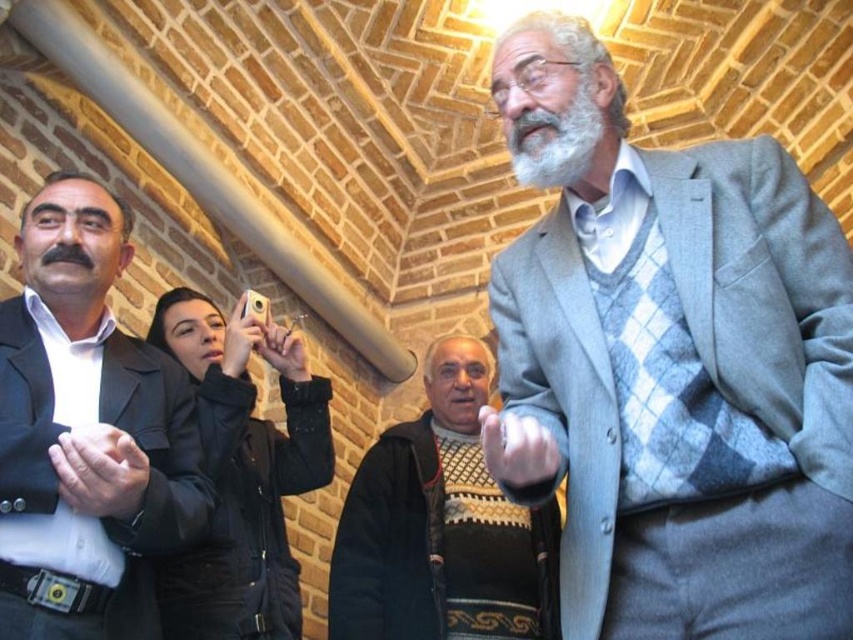
Is gray woolen suit at upper right in front of black matte suit at left?

That is True.

Does point (746, 148) come closer to viewer compared to point (44, 337)?

Yes, it is in front of point (44, 337).

Between point (699, 272) and point (132, 477), which one is positioned in front?

Point (132, 477) is in front.

Locate an element on the screen. The width and height of the screenshot is (853, 640). gray woolen suit at upper right is located at coordinates (676, 374).

Looking at this image, does gray woolen suit at upper right have a greater width compared to dark gray woolen suit at center?

Correct, the width of gray woolen suit at upper right exceeds that of dark gray woolen suit at center.

Is point (751, 156) in front of point (195, 598)?

Yes, point (751, 156) is in front of point (195, 598).

You are a GUI agent. You are given a task and a screenshot of the screen. Output one action in this format:
    pyautogui.click(x=<x>, y=<y>)
    Task: Click on the gray woolen suit at upper right
    
    Given the screenshot: What is the action you would take?
    pyautogui.click(x=676, y=374)

Is black matte suit at left above dark gray woolen suit at center?

Yes.

Which of these two, black matte suit at left or dark gray woolen suit at center, stands taller?

black matte suit at left

This screenshot has width=853, height=640. Find the location of `black matte suit at left`. black matte suit at left is located at coordinates (86, 433).

You are a GUI agent. You are given a task and a screenshot of the screen. Output one action in this format:
    pyautogui.click(x=<x>, y=<y>)
    Task: Click on the black matte suit at left
    The height and width of the screenshot is (640, 853).
    Given the screenshot: What is the action you would take?
    pyautogui.click(x=86, y=433)